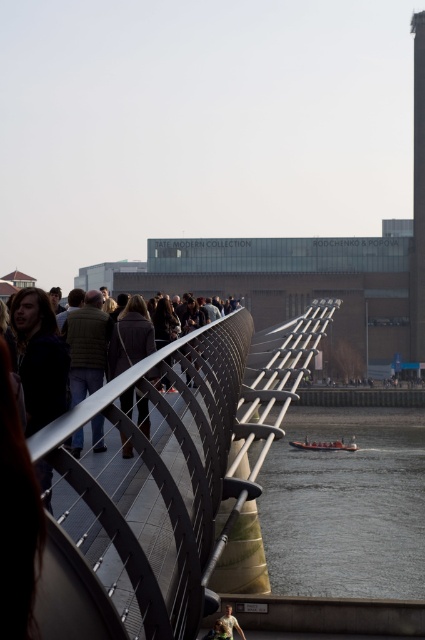
Question: Estimate the real-world distances between objects in this image. Which object is closer to the brown textured jacket at left?

Choices:
 (A) metallic bridge railing at center
 (B) light brown leather jacket at lower center
 (C) orange rubber boat at lower center

Answer: (B)

Question: From the image, what is the correct spatial relationship of brick tower at upper right in relation to orange rubber boat at lower center?

Choices:
 (A) below
 (B) above

Answer: (B)

Question: Can you confirm if dark brown wool coat at center is positioned to the left of light brown leather jacket at lower center?

Choices:
 (A) yes
 (B) no

Answer: (A)

Question: Which point appears closest to the camera in this image?

Choices:
 (A) (410, 294)
 (B) (311, 448)
 (C) (84, 380)
 (D) (122, 444)

Answer: (D)

Question: Can you confirm if brown textured jacket at left is positioned above brick tower at upper right?

Choices:
 (A) yes
 (B) no

Answer: (B)

Question: Which of the following is the closest to the observer?

Choices:
 (A) (130, 356)
 (B) (223, 621)
 (C) (215, 480)
 (D) (413, 188)

Answer: (C)